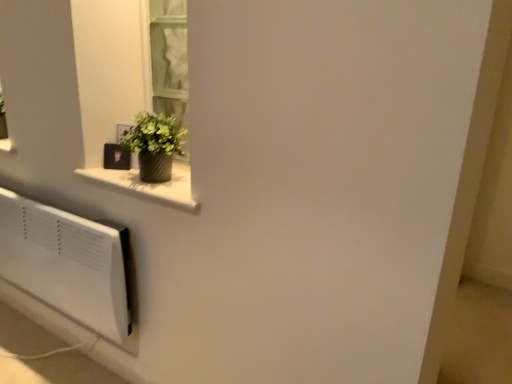
Find the location of a particular element. The width and height of the screenshot is (512, 384). free space underneath green textured vase at upper left (from a real-world perspective) is located at coordinates (144, 186).